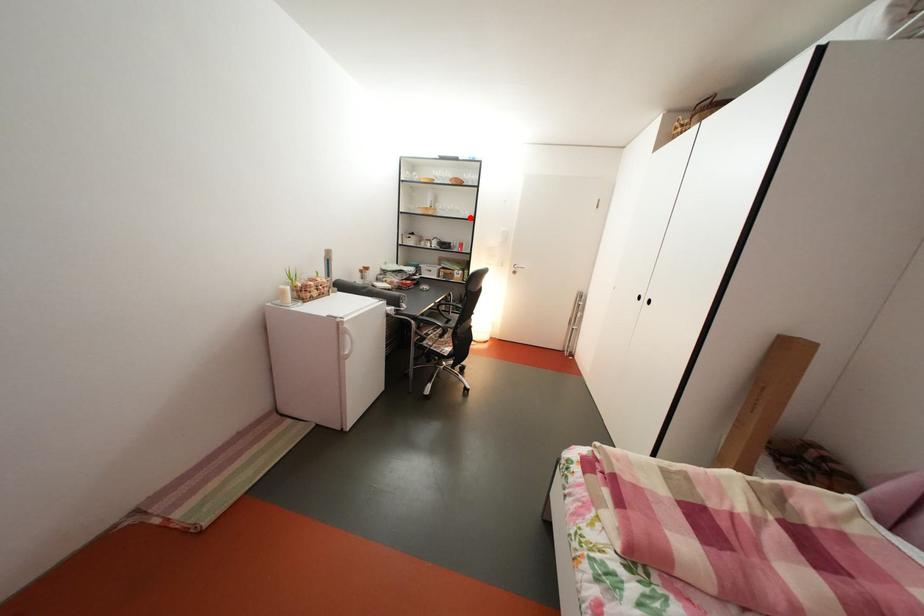
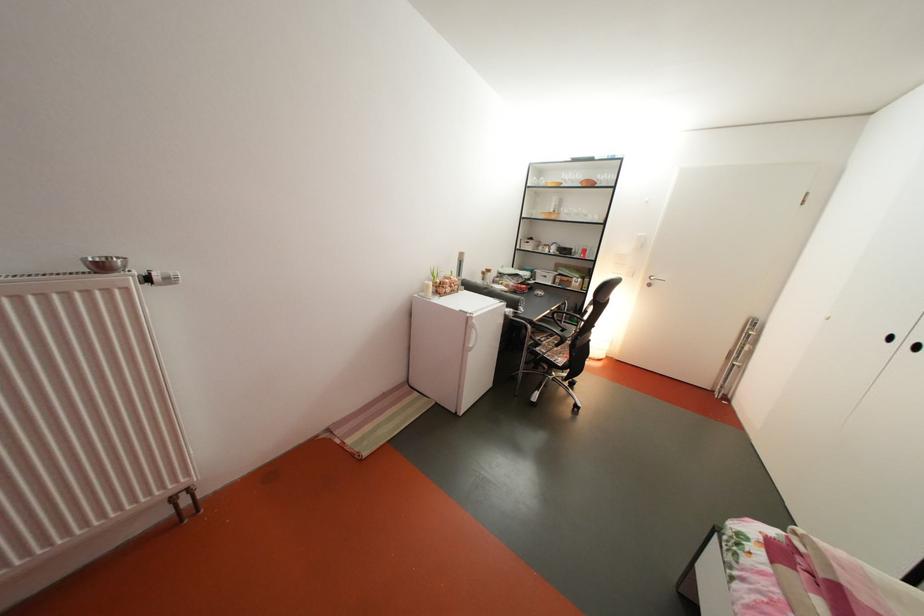
Where in the second image is the point corresponding to the highlighted location from the first image?

(598, 222)